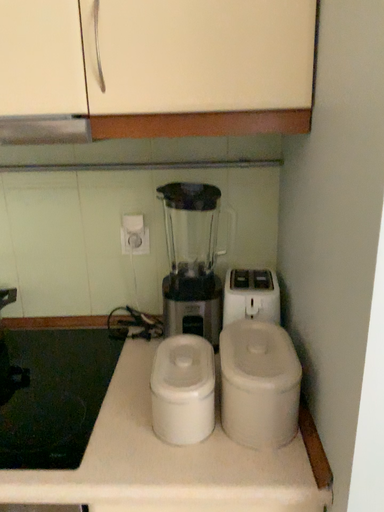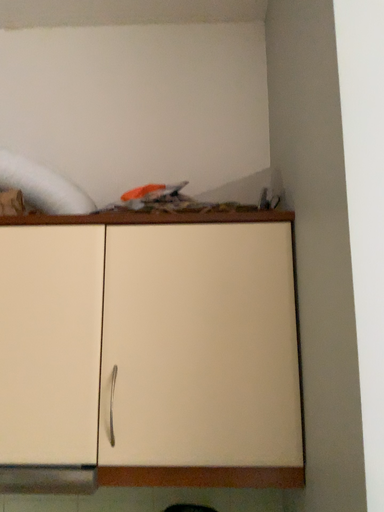
Question: Which way did the camera rotate in the video?

Choices:
 (A) rotated downward
 (B) rotated upward

Answer: (B)